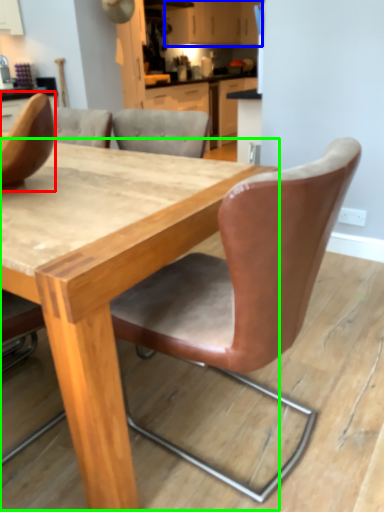
Question: Considering the real-world distances, which object is farthest from chair (highlighted by a red box)? cabinetry (highlighted by a blue box) or table (highlighted by a green box)?

Choices:
 (A) cabinetry
 (B) table

Answer: (A)